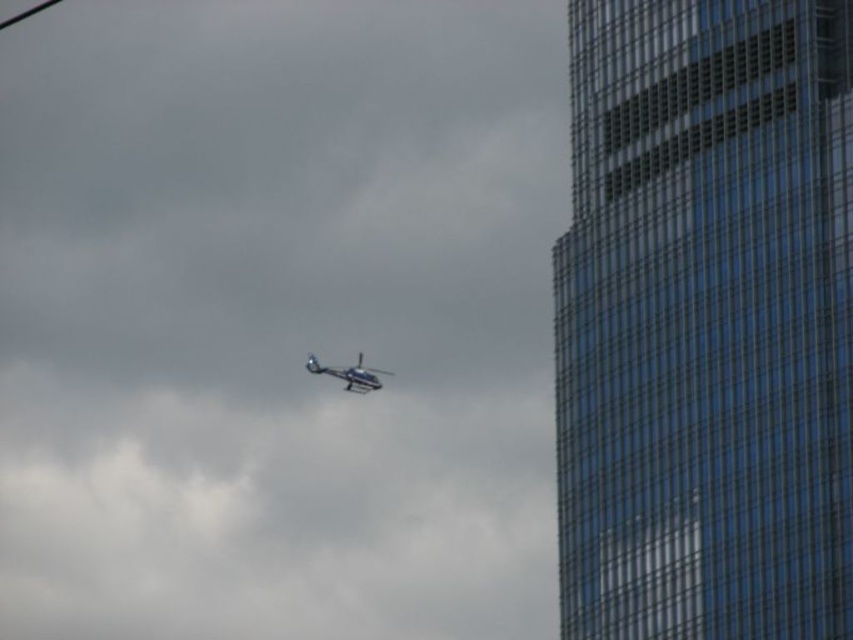
Looking at this image, does transparent glass tower at right come behind metallic silver helicopter at center?

No, transparent glass tower at right is in front of metallic silver helicopter at center.

This screenshot has width=853, height=640. Describe the element at coordinates (706, 321) in the screenshot. I see `transparent glass tower at right` at that location.

The image size is (853, 640). What are the coordinates of `transparent glass tower at right` in the screenshot? It's located at (706, 321).